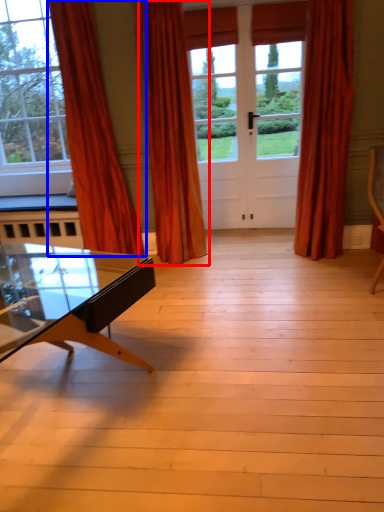
Question: Which object is closer to the camera taking this photo, curtain (highlighted by a red box) or curtain (highlighted by a blue box)?

Choices:
 (A) curtain
 (B) curtain

Answer: (B)